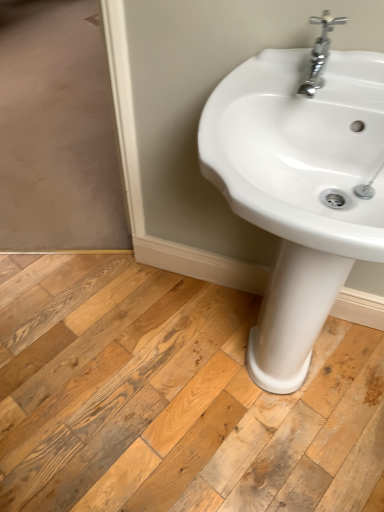
In order to face white glossy sink at center, should I rotate leftwards or rightwards?

Rotate right and turn 15.336 degrees.

Based on the photo, what is the approximate width of natural wood floor at center?

natural wood floor at center is 5.25 feet wide.

Locate an element on the screen. This screenshot has height=512, width=384. chrome metallic faucet at upper right is located at coordinates (319, 53).

Where is `white glossy sink at center`? The height and width of the screenshot is (512, 384). white glossy sink at center is located at coordinates (300, 184).

Which object is closer to the camera, natural wood floor at center or chrome metallic faucet at upper right?

chrome metallic faucet at upper right is more forward.

Which is more to the right, natural wood floor at center or chrome metallic faucet at upper right?

From the viewer's perspective, chrome metallic faucet at upper right appears more on the right side.

Is natural wood floor at center positioned with its back to chrome metallic faucet at upper right?

No, natural wood floor at center is not facing away from chrome metallic faucet at upper right.

Measure the distance from natural wood floor at center to chrome metallic faucet at upper right.

A distance of 36.34 inches exists between natural wood floor at center and chrome metallic faucet at upper right.

Is chrome metallic faucet at upper right inside or outside of white glossy sink at center?

The correct answer is: inside.

Between chrome metallic faucet at upper right and white glossy sink at center, which one has smaller size?

chrome metallic faucet at upper right.

Which is in front, point (322, 51) or point (302, 140)?

The point (322, 51) is more forward.

Based on the photo, is the depth of chrome metallic faucet at upper right less than that of white glossy sink at center?

No, it is not.

Is natural wood floor at center wider than white glossy sink at center?

Indeed, natural wood floor at center has a greater width compared to white glossy sink at center.

Considering the sizes of objects natural wood floor at center and white glossy sink at center in the image provided, who is shorter, natural wood floor at center or white glossy sink at center?

natural wood floor at center is shorter.

Is point (295, 449) positioned in front of point (368, 100)?

No, it is not.

Would you say chrome metallic faucet at upper right is part of white glossy sink at center's contents?

Yes, white glossy sink at center contains chrome metallic faucet at upper right.

From the image's perspective, who appears lower, white glossy sink at center or chrome metallic faucet at upper right?

white glossy sink at center is shown below in the image.

Does point (262, 122) lie behind point (324, 60)?

That is True.

Which of these two, white glossy sink at center or chrome metallic faucet at upper right, stands taller?

white glossy sink at center.

Does chrome metallic faucet at upper right appear on the left side of natural wood floor at center?

In fact, chrome metallic faucet at upper right is to the right of natural wood floor at center.

Considering the points (299, 91) and (262, 458), which point is in front, point (299, 91) or point (262, 458)?

Positioned in front is point (299, 91).

Does chrome metallic faucet at upper right have a lesser width compared to natural wood floor at center?

Yes, chrome metallic faucet at upper right is thinner than natural wood floor at center.

Is chrome metallic faucet at upper right oriented away from natural wood floor at center?

No, natural wood floor at center is not at the back of chrome metallic faucet at upper right.

Considering the positions of point (290, 77) and point (126, 452), is point (290, 77) closer or farther from the camera than point (126, 452)?

Point (290, 77).

Is white glossy sink at center further to the viewer compared to natural wood floor at center?

No, white glossy sink at center is closer to the camera.

Can natural wood floor at center be found inside white glossy sink at center?

No, natural wood floor at center is not a part of white glossy sink at center.

Considering the relative sizes of white glossy sink at center and natural wood floor at center in the image provided, is white glossy sink at center thinner than natural wood floor at center?

Yes, white glossy sink at center is thinner than natural wood floor at center.

Where is `tap above the natural wood floor at center (from the image's perspective)`? tap above the natural wood floor at center (from the image's perspective) is located at coordinates (319, 53).

Find the location of a particular element. The width and height of the screenshot is (384, 512). tap behind the white glossy sink at center is located at coordinates (319, 53).

Which object lies further to the anchor point white glossy sink at center, natural wood floor at center or chrome metallic faucet at upper right?

The object further to white glossy sink at center is natural wood floor at center.

Estimate the real-world distances between objects in this image. Which object is closer to natural wood floor at center, white glossy sink at center or chrome metallic faucet at upper right?

white glossy sink at center is positioned closer to the anchor natural wood floor at center.

Looking at the image, which one is located further to natural wood floor at center, chrome metallic faucet at upper right or white glossy sink at center?

chrome metallic faucet at upper right lies further to natural wood floor at center than the other object.

Looking at the image, which one is located further to chrome metallic faucet at upper right, natural wood floor at center or white glossy sink at center?

natural wood floor at center lies further to chrome metallic faucet at upper right than the other object.

From the image, which object appears to be farther from white glossy sink at center, chrome metallic faucet at upper right or natural wood floor at center?

natural wood floor at center is further to white glossy sink at center.

Considering their positions, is white glossy sink at center positioned closer to chrome metallic faucet at upper right than natural wood floor at center?

white glossy sink at center is positioned closer to the anchor chrome metallic faucet at upper right.

Image resolution: width=384 pixels, height=512 pixels. In order to click on sink between chrome metallic faucet at upper right and natural wood floor at center in the up-down direction in this screenshot , I will do `click(300, 184)`.